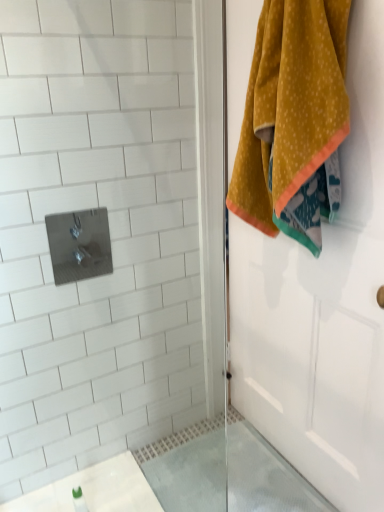
What is the approximate width of velvety mustard towel at right?

9.18 inches.

Locate an element on the screen. velvety mustard towel at right is located at coordinates (291, 114).

Describe the element at coordinates (291, 114) in the screenshot. The width and height of the screenshot is (384, 512). I see `velvety mustard towel at right` at that location.

What are the coordinates of `velvety mustard towel at right` in the screenshot? It's located at pos(291,114).